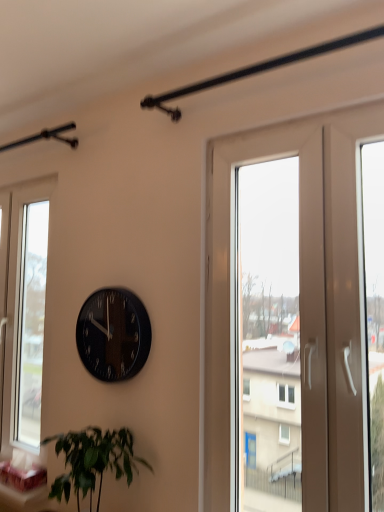
This screenshot has width=384, height=512. In order to click on white glossy screen door at right in this screenshot , I will do `click(299, 301)`.

At what (x,y) coordinates should I click in order to perform the action: click on transparent glass window at left. Please return your answer as a coordinate pair (x, y). The width and height of the screenshot is (384, 512). Looking at the image, I should click on (23, 312).

From a real-world perspective, is black glossy clock at center beneath transparent glass window at left?

Yes, from a real-world perspective, black glossy clock at center is beneath transparent glass window at left.

From the image's perspective, between black glossy clock at center and transparent glass window at left, who is located below?

transparent glass window at left appears lower in the image.

Is transparent glass window at left at the back of black glossy clock at center?

That's not correct — black glossy clock at center is not looking away from transparent glass window at left.

Which of these two, black glossy clock at center or transparent glass window at left, is bigger?

With larger size is transparent glass window at left.

In the scene shown: Between white glossy screen door at right and green leafy plant at lower left, which one has less height?

green leafy plant at lower left is shorter.

From a real-world perspective, is white glossy screen door at right above or below green leafy plant at lower left?

white glossy screen door at right is situated higher than green leafy plant at lower left in the real world.

Looking at this image, is white glossy screen door at right looking in the opposite direction of green leafy plant at lower left?

No, white glossy screen door at right is not facing the opposite direction of green leafy plant at lower left.

From a real-world perspective, which is physically below, green leafy plant at lower left or transparent glass window at left?

green leafy plant at lower left, from a real-world perspective.

Is green leafy plant at lower left taller than transparent glass window at left?

No.

Considering the positions of point (104, 446) and point (38, 367), is point (104, 446) closer or farther from the camera than point (38, 367)?

Clearly, point (104, 446) is closer to the camera than point (38, 367).

Is green leafy plant at lower left next to transparent glass window at left and touching it?

No, green leafy plant at lower left is not beside transparent glass window at left.

I want to click on window on the left of the white glossy screen door at right, so click(23, 312).

Does point (213, 492) lie behind point (21, 377)?

That is False.

Is the depth of white glossy screen door at right less than that of transparent glass window at left?

That is True.

Looking at this image, can you confirm if white glossy screen door at right is positioned to the left of transparent glass window at left?

No, white glossy screen door at right is not to the left of transparent glass window at left.

Considering the sizes of black glossy clock at center and green leafy plant at lower left in the image, is black glossy clock at center bigger or smaller than green leafy plant at lower left?

In the image, black glossy clock at center appears to be smaller than green leafy plant at lower left.

From a real-world perspective, is black glossy clock at center below green leafy plant at lower left?

No, from a real-world perspective, black glossy clock at center is not beneath green leafy plant at lower left.

Which object is closer to the camera, black glossy clock at center or green leafy plant at lower left?

green leafy plant at lower left is more forward.

Which object is closer to the camera taking this photo, green leafy plant at lower left or white glossy screen door at right?

Positioned in front is white glossy screen door at right.

From the image's perspective, is green leafy plant at lower left under white glossy screen door at right?

Yes, from the image's perspective, green leafy plant at lower left is below white glossy screen door at right.

Can you tell me how much green leafy plant at lower left and white glossy screen door at right differ in facing direction?

0.0722 degrees separate the facing orientations of green leafy plant at lower left and white glossy screen door at right.

Is white glossy screen door at right at the back of green leafy plant at lower left?

No, green leafy plant at lower left is not facing away from white glossy screen door at right.

Is transparent glass window at left not close to black glossy clock at center?

transparent glass window at left is actually quite close to black glossy clock at center.

Do you think transparent glass window at left is within black glossy clock at center, or outside of it?

transparent glass window at left is outside black glossy clock at center.

From the picture: Considering the relative sizes of transparent glass window at left and black glossy clock at center in the image provided, is transparent glass window at left bigger than black glossy clock at center?

Correct, transparent glass window at left is larger in size than black glossy clock at center.

How distant is transparent glass window at left from black glossy clock at center?

28.03 inches.

Image resolution: width=384 pixels, height=512 pixels. I want to click on window that appears behind the black glossy clock at center, so click(x=23, y=312).

Find the location of a particular element. The width and height of the screenshot is (384, 512). houseplant on the left of white glossy screen door at right is located at coordinates coord(93,460).

Based on their spatial positions, is transparent glass window at left or black glossy clock at center closer to green leafy plant at lower left?

black glossy clock at center is positioned closer to the anchor green leafy plant at lower left.

In the scene shown: Based on their spatial positions, is green leafy plant at lower left or white glossy screen door at right further from black glossy clock at center?

The object further to black glossy clock at center is white glossy screen door at right.

Considering their positions, is white glossy screen door at right positioned further to transparent glass window at left than black glossy clock at center?

white glossy screen door at right lies further to transparent glass window at left than the other object.

When comparing their distances from black glossy clock at center, does transparent glass window at left or green leafy plant at lower left seem further?

transparent glass window at left is further to black glossy clock at center.

Based on their spatial positions, is white glossy screen door at right or green leafy plant at lower left closer to transparent glass window at left?

green leafy plant at lower left is closer to transparent glass window at left.

From the image, which object appears to be nearer to transparent glass window at left, green leafy plant at lower left or black glossy clock at center?

Based on the image, black glossy clock at center appears to be nearer to transparent glass window at left.

Considering their positions, is green leafy plant at lower left positioned closer to white glossy screen door at right than black glossy clock at center?

black glossy clock at center is positioned closer to the anchor white glossy screen door at right.

Considering their positions, is white glossy screen door at right positioned closer to black glossy clock at center than transparent glass window at left?

white glossy screen door at right is closer to black glossy clock at center.

In order to click on houseplant between transparent glass window at left and black glossy clock at center from left to right in this screenshot , I will do `click(93, 460)`.

This screenshot has height=512, width=384. What are the coordinates of `wall clock located between green leafy plant at lower left and white glossy screen door at right in the left-right direction` in the screenshot? It's located at (113, 334).

Where is `wall clock located between transparent glass window at left and white glossy screen door at right in the left-right direction`? wall clock located between transparent glass window at left and white glossy screen door at right in the left-right direction is located at coordinates (113, 334).

Locate an element on the screen. This screenshot has width=384, height=512. houseplant between transparent glass window at left and white glossy screen door at right from left to right is located at coordinates (93, 460).